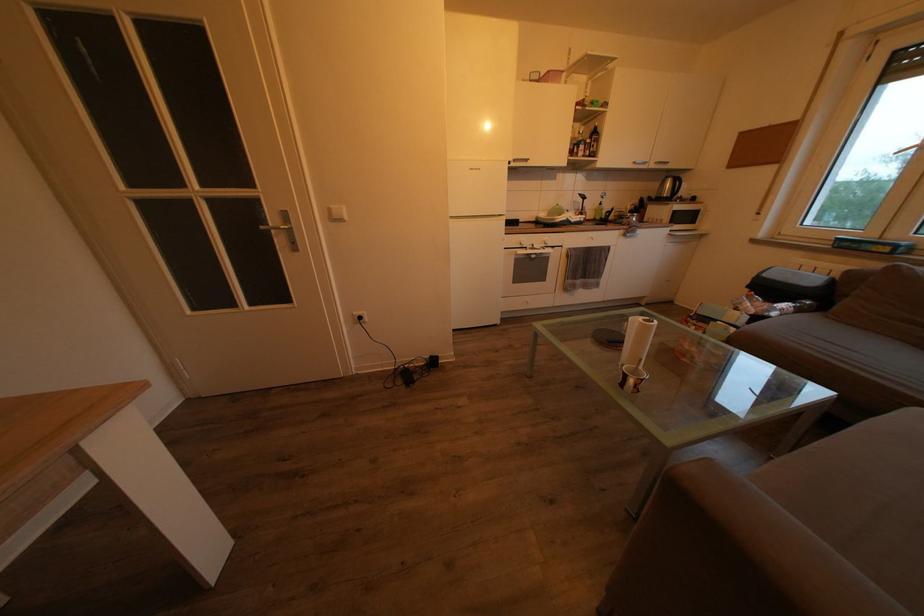
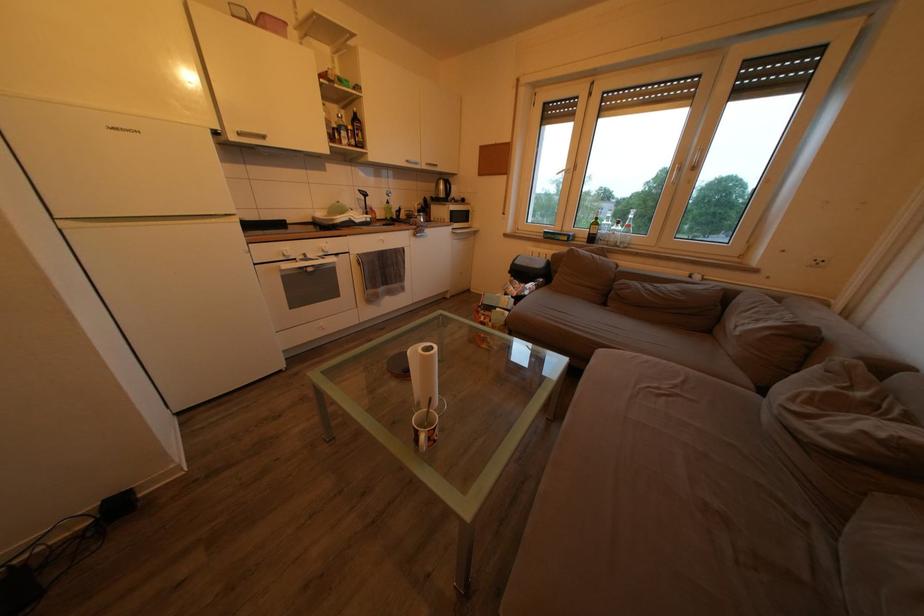
Question: The camera is either moving clockwise (left) or counter-clockwise (right) around the object. The first image is from the beginning of the video and the second image is from the end. Is the camera moving left or right when shooting the video?

Choices:
 (A) Left
 (B) Right

Answer: (A)